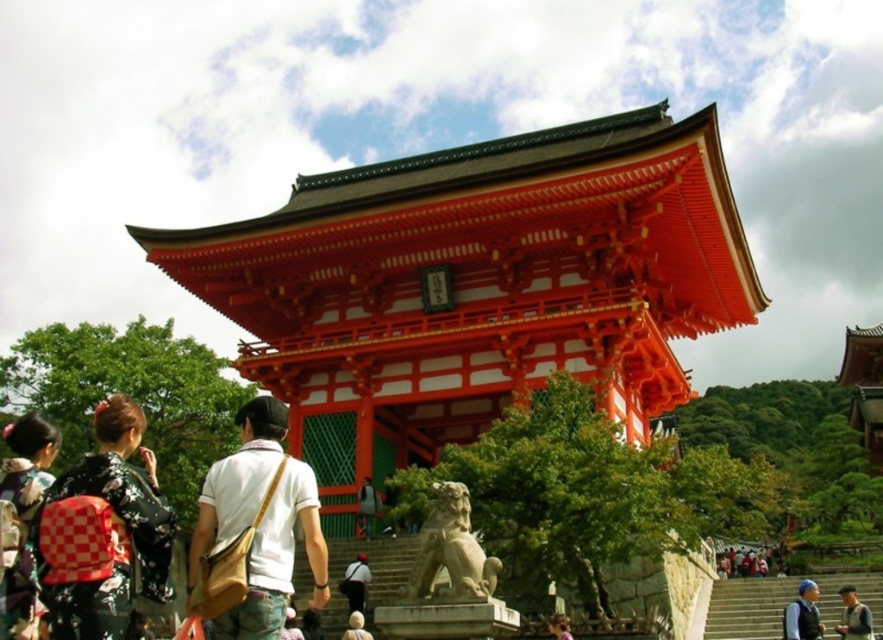
Question: Estimate the real-world distances between objects in this image. Which object is farther from the shiny lacquered pagoda at center?

Choices:
 (A) gray fabric jacket at lower right
 (B) light brown leather backpack at center
 (C) light beige fabric backpack at center
 (D) brown canvas bag at center

Answer: (D)

Question: Does brown canvas bag at center have a smaller size compared to light beige fabric backpack at center?

Choices:
 (A) no
 (B) yes

Answer: (A)

Question: Which object is positioned farthest from the kimono at left?

Choices:
 (A) light beige fabric backpack at center
 (B) shiny lacquered pagoda at center

Answer: (B)

Question: Which of the following is the farthest from the observer?

Choices:
 (A) (210, 595)
 (B) (165, 532)
 (C) (19, 573)

Answer: (B)

Question: Can you confirm if shiny lacquered pagoda at center is smaller than stone stairs at lower right?

Choices:
 (A) yes
 (B) no

Answer: (B)

Question: Can you confirm if shiny lacquered pagoda at center is positioned below gray fabric jacket at lower right?

Choices:
 (A) yes
 (B) no

Answer: (B)